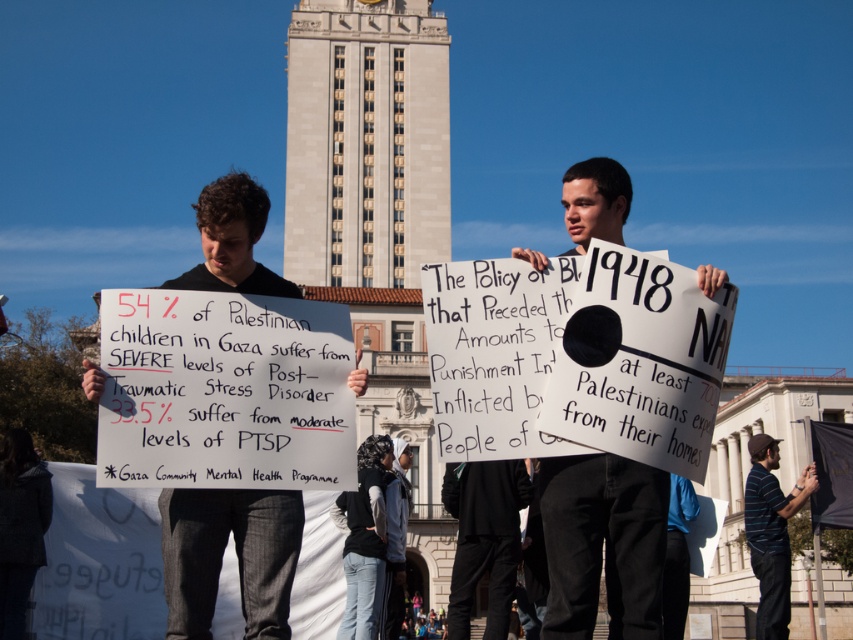
Is white paper sign at center thinner than black cotton pants at lower center?

No, white paper sign at center is not thinner than black cotton pants at lower center.

Between white paper sign at center and black cotton pants at lower center, which one appears on the right side from the viewer's perspective?

white paper sign at center is more to the right.

What do you see at coordinates (602, 544) in the screenshot? I see `white paper sign at center` at bounding box center [602, 544].

Locate an element on the screen. This screenshot has width=853, height=640. white paper sign at center is located at coordinates (602, 544).

Is black cotton pants at lower center below striped polo shirt at lower right?

No, black cotton pants at lower center is not below striped polo shirt at lower right.

Does black cotton pants at lower center have a lesser height compared to striped polo shirt at lower right?

No.

Locate an element on the screen. The height and width of the screenshot is (640, 853). black cotton pants at lower center is located at coordinates (x=485, y=538).

Does black fabric shirt at center appear under striped polo shirt at lower right?

Actually, black fabric shirt at center is above striped polo shirt at lower right.

Is point (251, 202) closer to viewer compared to point (793, 500)?

That is True.

The height and width of the screenshot is (640, 853). Identify the location of black fabric shirt at center. (222, 554).